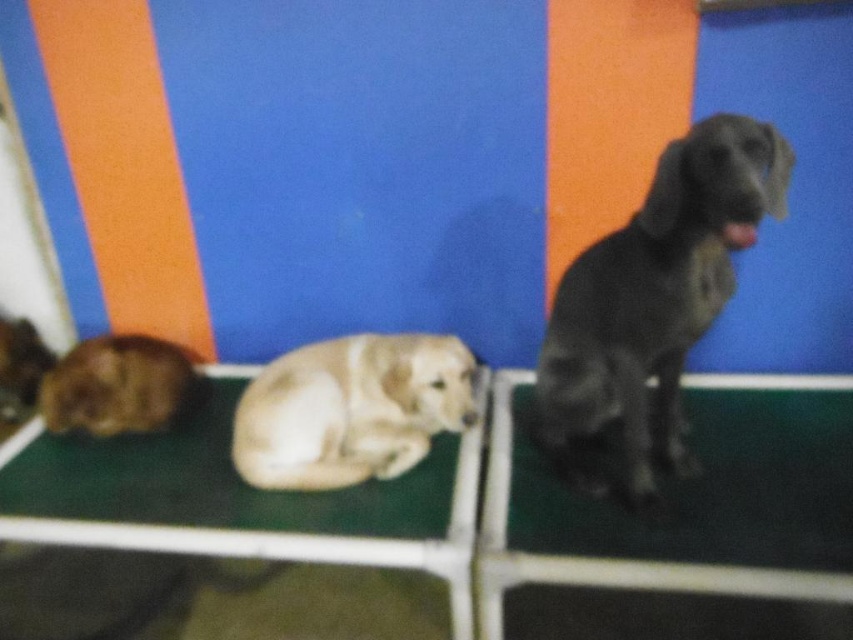
Who is more distant from viewer, (670,141) or (119,486)?

The point (670,141) is more distant.

Between shiny black dog at right and white soft mat at center, which one has more height?

shiny black dog at right is taller.

Is point (589, 282) positioned after point (300, 525)?

Yes, it is behind point (300, 525).

The width and height of the screenshot is (853, 640). Find the location of `shiny black dog at right`. shiny black dog at right is located at coordinates (653, 304).

Is light brown fur at center smaller than shiny brown fur at lower left?

Incorrect, light brown fur at center is not smaller in size than shiny brown fur at lower left.

Locate an element on the screen. Image resolution: width=853 pixels, height=640 pixels. light brown fur at center is located at coordinates (351, 410).

You are a GUI agent. You are given a task and a screenshot of the screen. Output one action in this format:
    pyautogui.click(x=<x>, y=<y>)
    Task: Click on the light brown fur at center
    The image size is (853, 640).
    Given the screenshot: What is the action you would take?
    pyautogui.click(x=351, y=410)

Is white soft mat at center smaller than light brown fur at center?

Incorrect, white soft mat at center is not smaller in size than light brown fur at center.

Does white soft mat at center have a greater width compared to light brown fur at center?

Yes.

This screenshot has width=853, height=640. In order to click on white soft mat at center in this screenshot , I will do `click(218, 483)`.

I want to click on white soft mat at center, so click(218, 483).